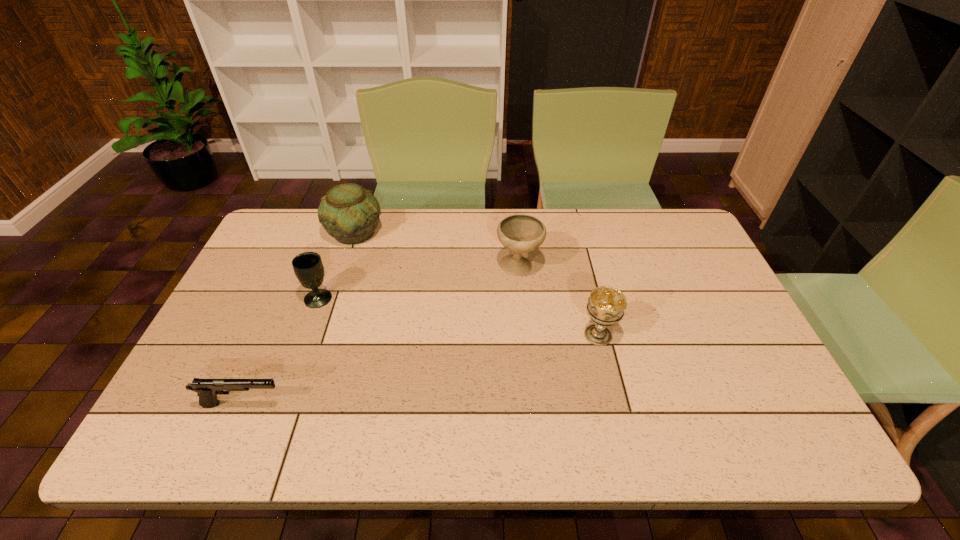
Identify the location of free space located 0.090m on the right of the fourth object from left to right. This screenshot has height=540, width=960. (571, 267).

The height and width of the screenshot is (540, 960). I want to click on vacant space located on the front of the second nearest chalice, so (x=293, y=368).

The height and width of the screenshot is (540, 960). I want to click on vacant space located 0.190m on the back of the rightmost chalice, so click(x=583, y=274).

The image size is (960, 540). What are the coordinates of `vacant space located 0.090m at the aiming end of the shortest object` in the screenshot? It's located at (324, 404).

This screenshot has height=540, width=960. I want to click on pottery positioned at the far edge, so click(349, 213).

The image size is (960, 540). What are the coordinates of `chalice that is at the far edge` in the screenshot? It's located at (519, 233).

What are the coordinates of `object present at the left edge` in the screenshot? It's located at (207, 389).

Locate an element on the screen. The image size is (960, 540). vacant space at the far edge is located at coordinates tap(417, 226).

The height and width of the screenshot is (540, 960). What are the coordinates of `vacant space at the left edge of the desktop` in the screenshot? It's located at (283, 297).

Locate an element on the screen. This screenshot has height=540, width=960. free spot at the far right corner of the desktop is located at coordinates (652, 230).